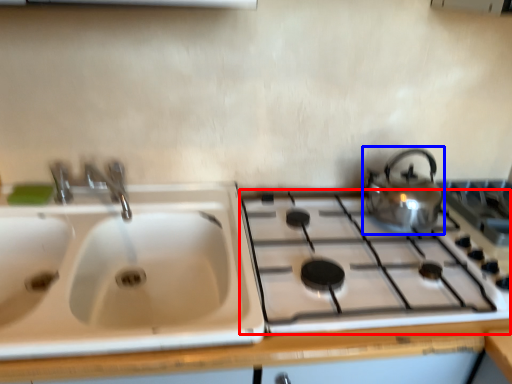
Question: Which point is further to the camera, gas stove (highlighted by a red box) or kettle (highlighted by a blue box)?

Choices:
 (A) gas stove
 (B) kettle

Answer: (B)